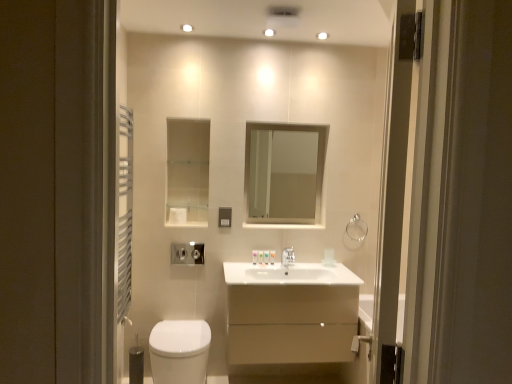
In order to click on free spot to the right of white glossy toiletries at center, marked as the first toiletry in a right-to-left arrangement in this screenshot , I will do pyautogui.click(x=294, y=266).